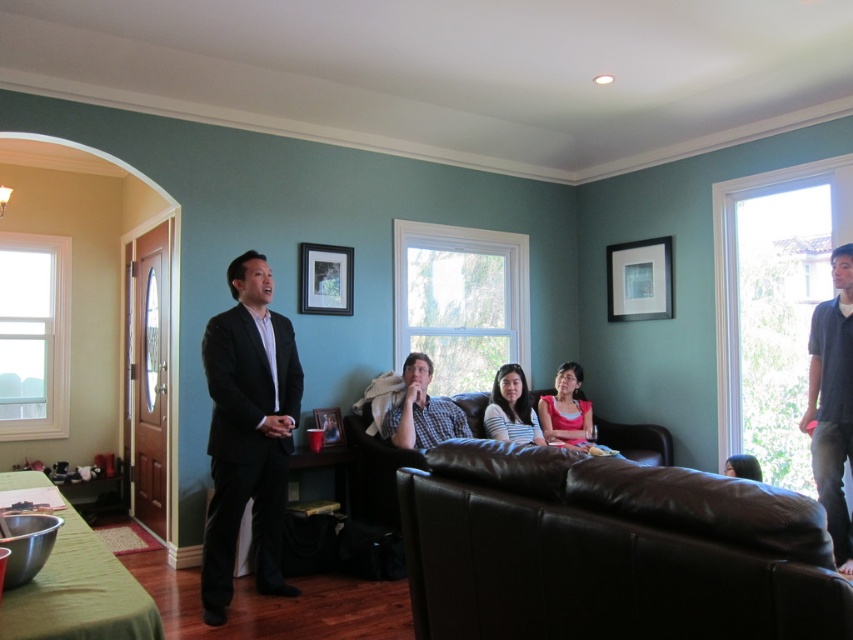
Is point (828, 326) positioned behind point (730, 456)?

No.

In the scene shown: Can you confirm if dark blue shirt at right is smaller than matte black hair at center?

No, dark blue shirt at right is not smaller than matte black hair at center.

Is point (817, 305) farther from viewer compared to point (753, 477)?

No.

The image size is (853, 640). Find the location of `dark blue shirt at right`. dark blue shirt at right is located at coordinates (833, 403).

Based on the photo, does black suit at left come behind pink matte shirt at center?

No.

Is black suit at left taller than pink matte shirt at center?

Indeed, black suit at left has a greater height compared to pink matte shirt at center.

Which is in front, point (271, 312) or point (552, 428)?

Point (271, 312)

You are a GUI agent. You are given a task and a screenshot of the screen. Output one action in this format:
    pyautogui.click(x=<x>, y=<y>)
    Task: Click on the black suit at left
    The width and height of the screenshot is (853, 640).
    Given the screenshot: What is the action you would take?
    pyautogui.click(x=247, y=433)

You are a GUI agent. You are given a task and a screenshot of the screen. Output one action in this format:
    pyautogui.click(x=<x>, y=<y>)
    Task: Click on the dark blue shirt at right
    The image size is (853, 640).
    Given the screenshot: What is the action you would take?
    pyautogui.click(x=833, y=403)

How much distance is there between dark blue shirt at right and pink matte shirt at center?

A distance of 1.52 meters exists between dark blue shirt at right and pink matte shirt at center.

The width and height of the screenshot is (853, 640). Identify the location of dark blue shirt at right. (833, 403).